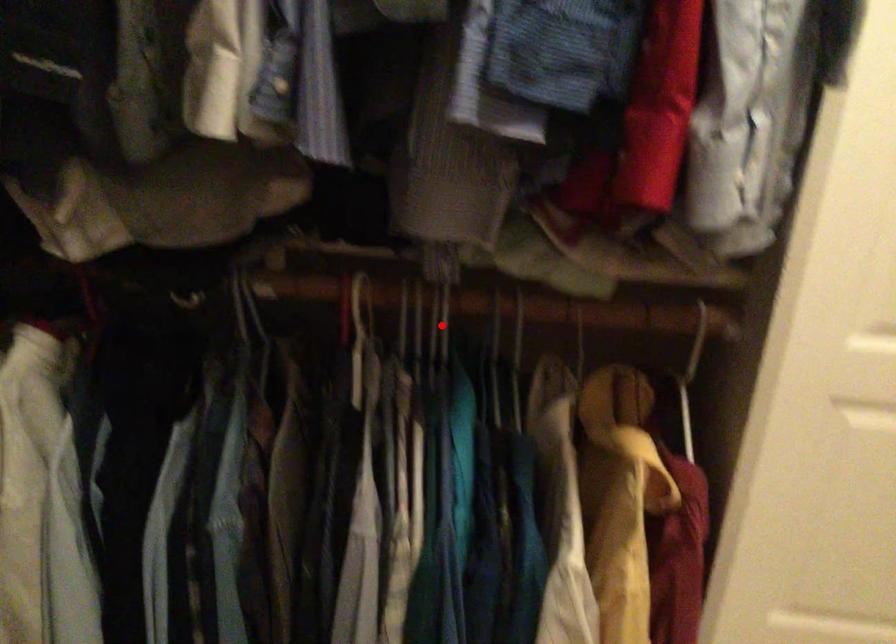
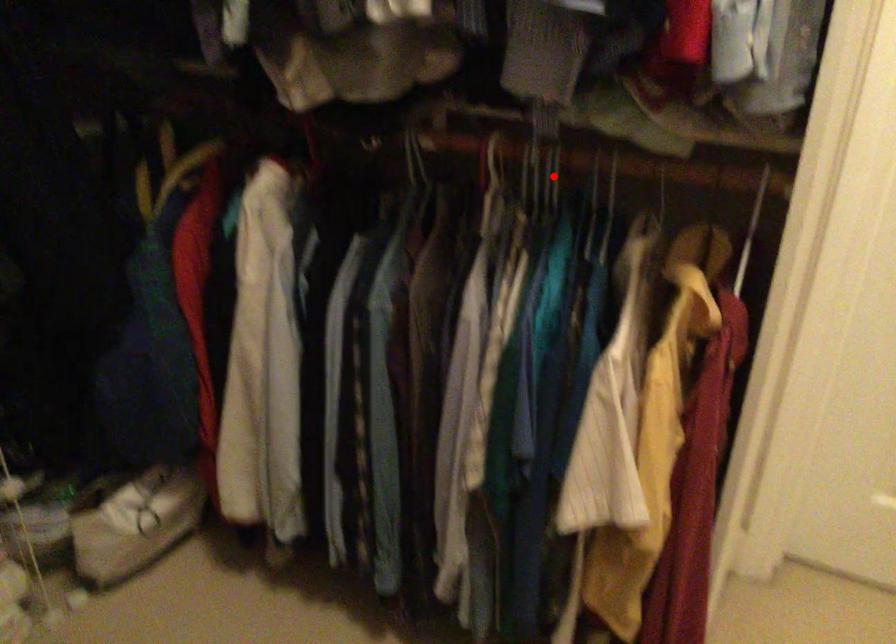
I am providing you with two images of the same scene from different viewpoints. A red point is marked on the first image and another point is marked on the second image. Is the red point in image1 aligned with the point shown in image2?

Yes